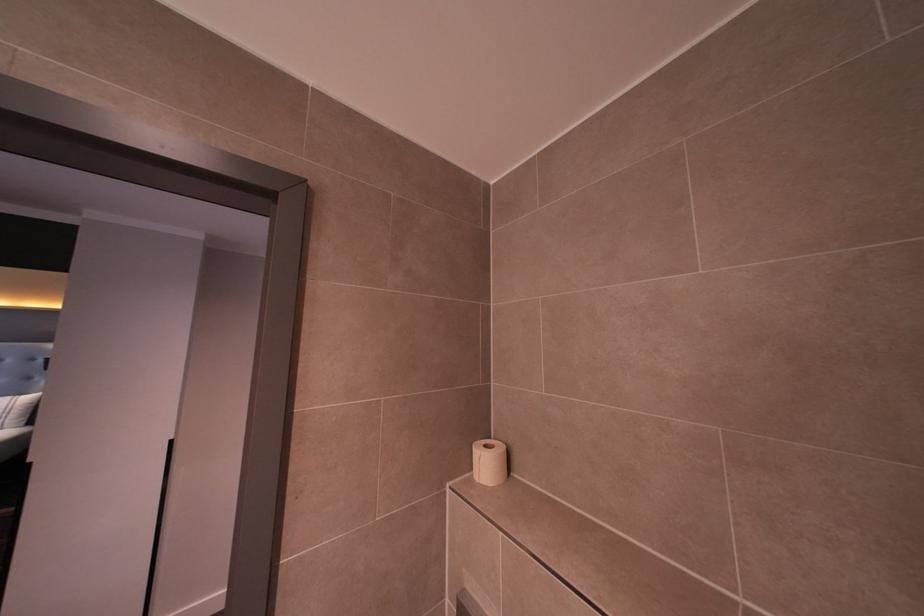
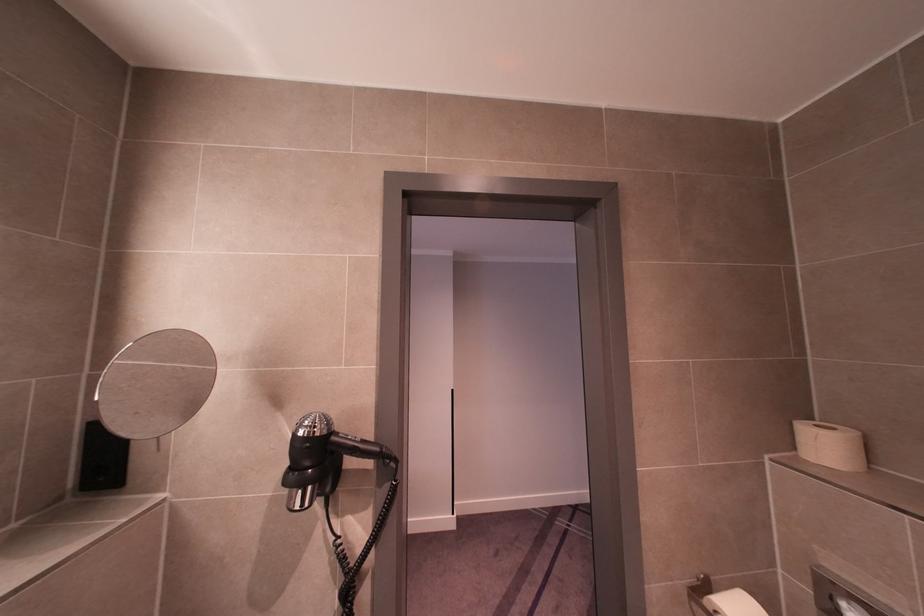
Find the pixel in the second image that matches point (484, 464) in the first image.

(823, 446)